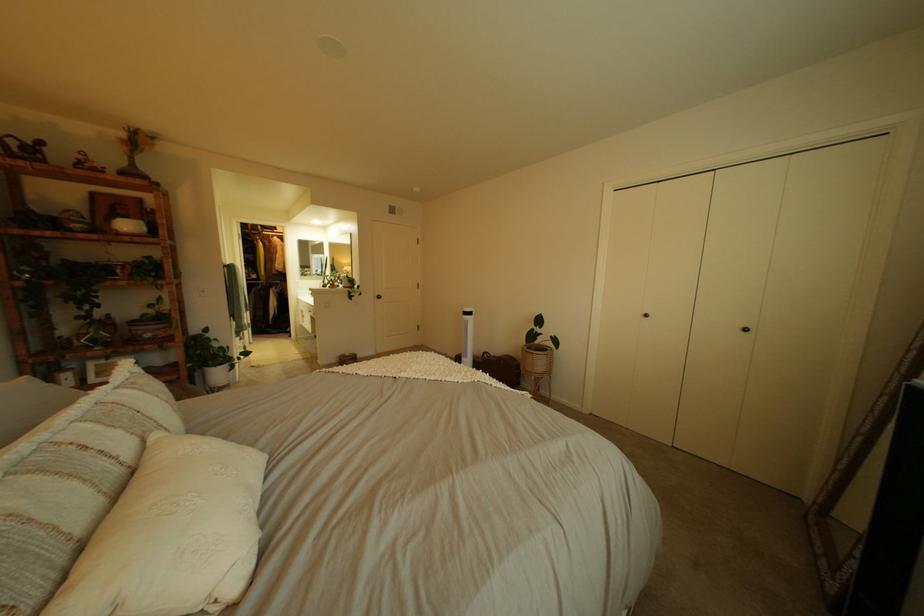
Image resolution: width=924 pixels, height=616 pixels. I want to click on closet door knob, so click(262, 236).